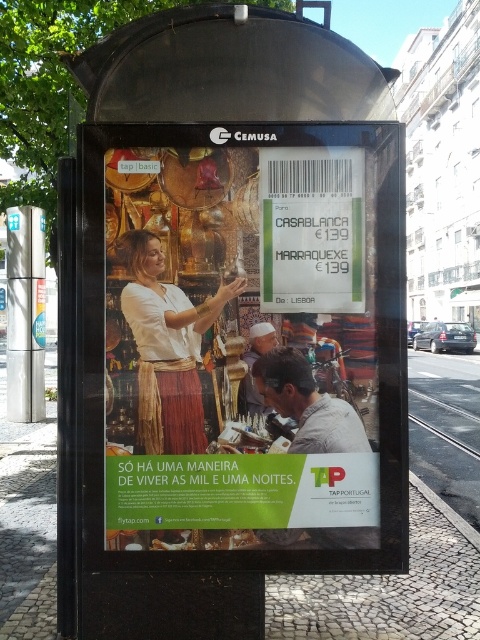
Question: Observing the image, what is the correct spatial positioning of matte gold poster at center in reference to green matte sign at center?

Choices:
 (A) left
 (B) right

Answer: (A)

Question: Which point is farther from the camera taking this photo?

Choices:
 (A) (243, 356)
 (B) (180, 348)
 (C) (337, 580)
 (D) (288, 349)

Answer: (C)

Question: Which point appears farthest from the camera in this image?

Choices:
 (A) (297, 307)
 (B) (127, 435)
 (C) (288, 252)
 (D) (201, 388)

Answer: (C)

Question: Which of the following is the closest to the observer?

Choices:
 (A) white cotton blouse at center
 (B) black plastic bus stop at center
 (C) matte gold headscarf at center

Answer: (B)

Question: Is matte gold poster at center positioned behind green matte sign at center?

Choices:
 (A) yes
 (B) no

Answer: (B)

Question: Is green matte sign at center below white cotton blouse at center?

Choices:
 (A) yes
 (B) no

Answer: (B)